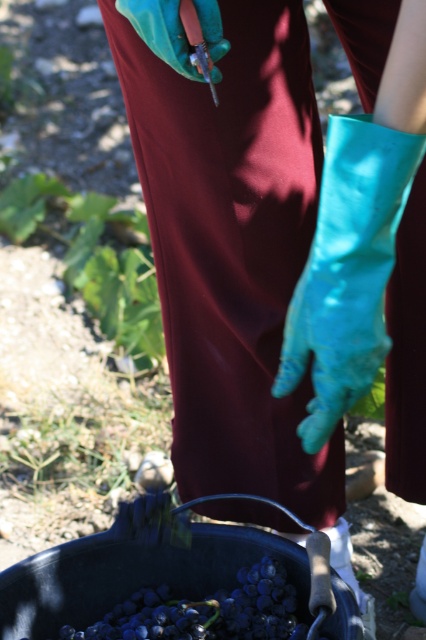
Question: Can you confirm if shiny purple grapes at lower center is positioned above teal rubber glove at upper center?

Choices:
 (A) yes
 (B) no

Answer: (B)

Question: Is shiny purple grapes at lower center bigger than teal rubber glove at upper center?

Choices:
 (A) no
 (B) yes

Answer: (B)

Question: Which point is closer to the camera?

Choices:
 (A) shiny purple grapes at lower center
 (B) teal rubber glove at center

Answer: (B)

Question: Considering the real-world distances, which object is farthest from the teal rubber glove at upper center?

Choices:
 (A) teal rubber glove at center
 (B) shiny purple grapes at lower center

Answer: (B)

Question: Does teal rubber glove at center lie behind shiny purple grapes at lower center?

Choices:
 (A) yes
 (B) no

Answer: (B)

Question: Which point is closer to the camera?

Choices:
 (A) (158, 0)
 (B) (377, 209)
 (C) (294, 618)

Answer: (B)